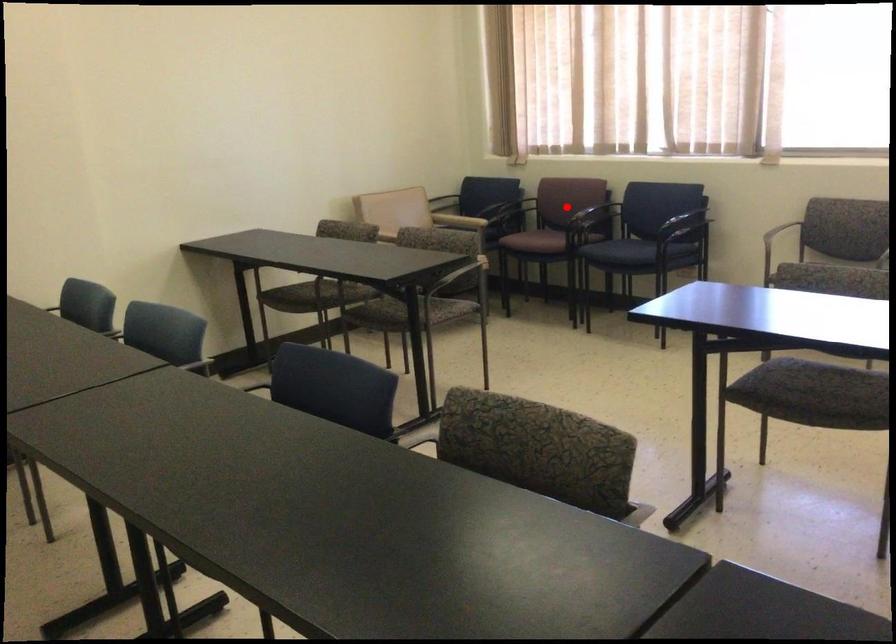
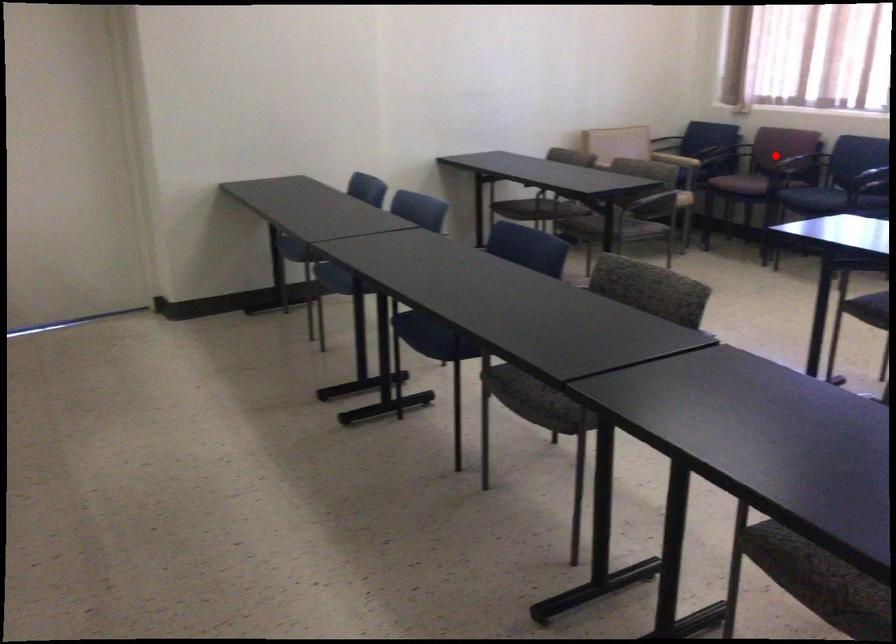
I am providing you with two images of the same scene from different viewpoints. A red point is marked on the first image and another point is marked on the second image. Are the points marked in image1 and image2 representing the same 3D position?

Yes